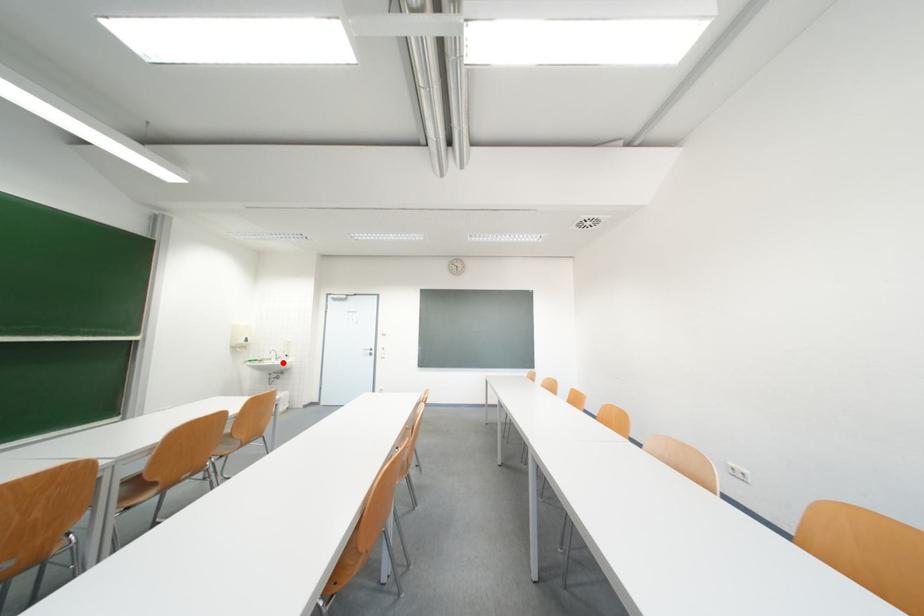
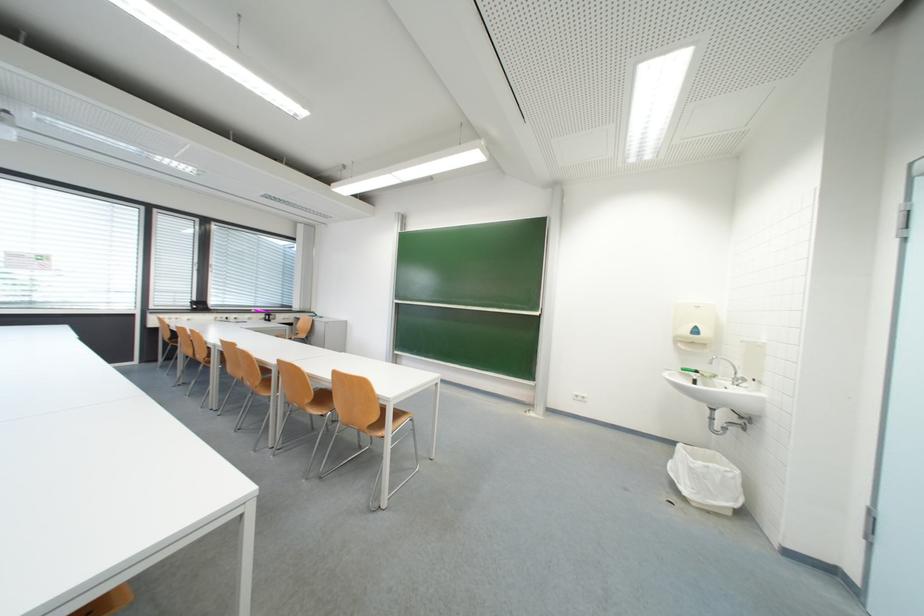
Question: A red point is marked in image1. In image2, is the corresponding 3D point closer to the camera or farther? Reply with the corresponding letter.

Choices:
 (A) The corresponding 3D point is closer.
 (B) The corresponding 3D point is farther.

Answer: (B)